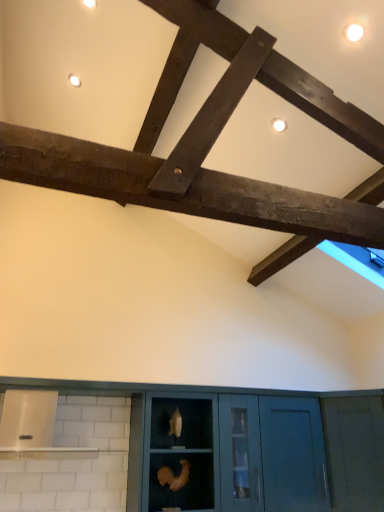
Describe the element at coordinates (237, 454) in the screenshot. I see `teal matte cabinet at lower center` at that location.

What are the coordinates of `teal matte cabinet at lower center` in the screenshot? It's located at (237, 454).

The height and width of the screenshot is (512, 384). Identify the location of teal matte cabinet at lower center. (237, 454).